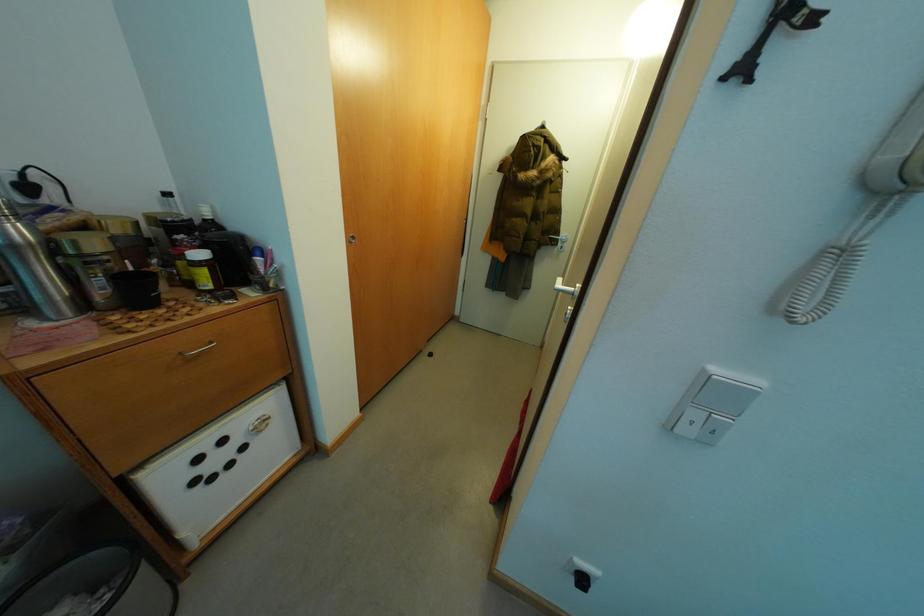
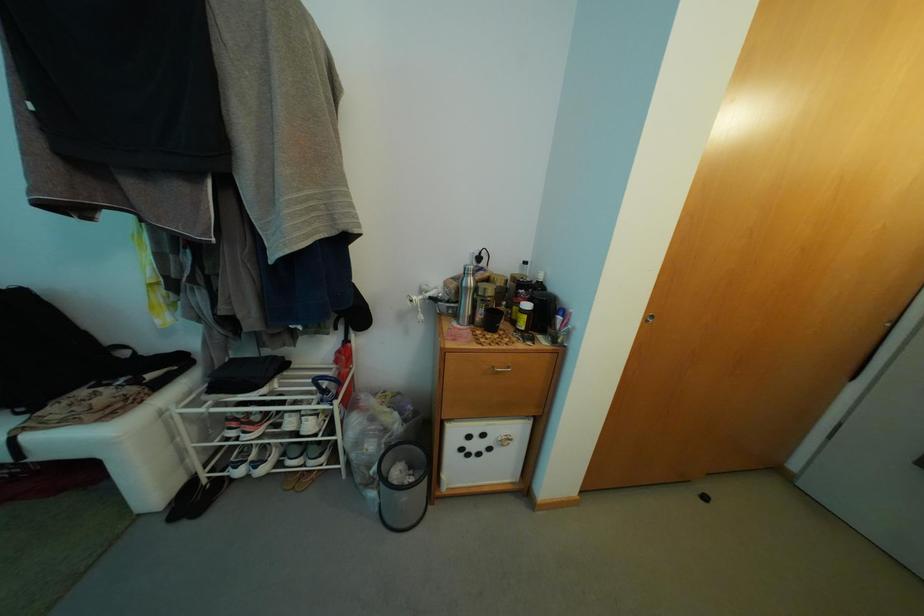
Question: Based on the continuous images, in which direction is the camera rotating? Reply with the corresponding letter.

Choices:
 (A) Left
 (B) Right
 (C) Up
 (D) Down

Answer: (A)